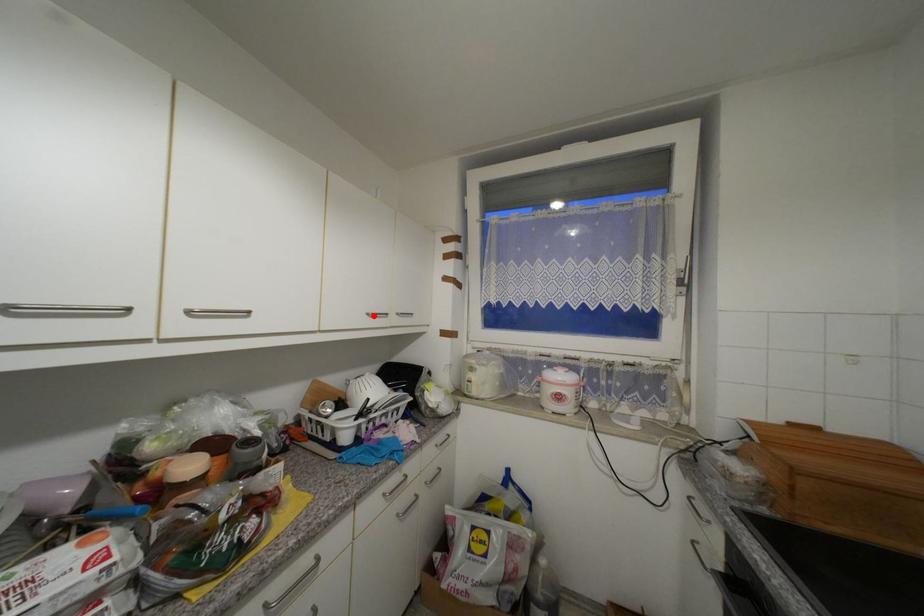
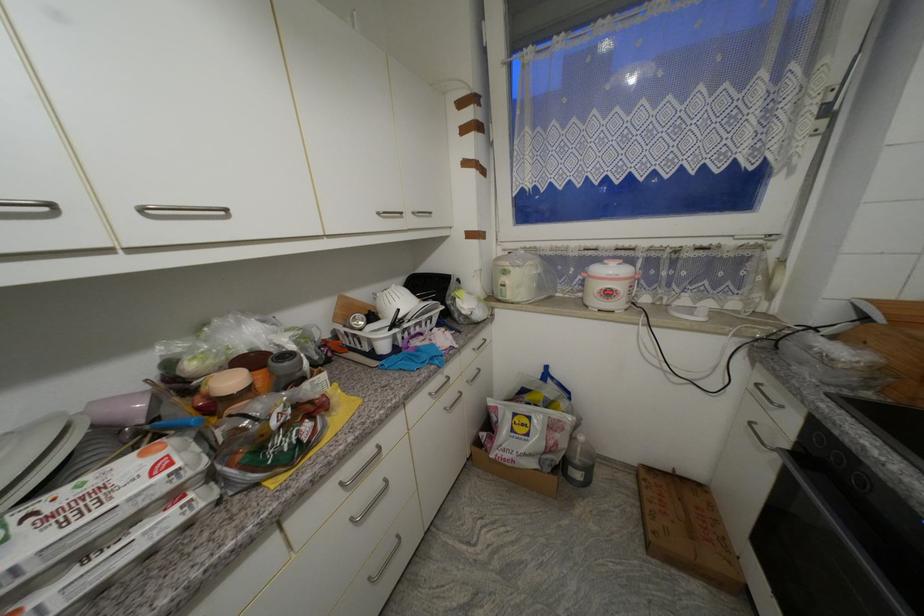
Find the pixel in the second image that matches the highlighted location in the first image.

(383, 215)